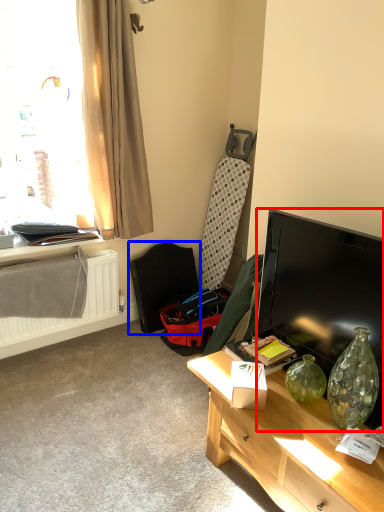
Question: Which of the following is the farthest to the observer, television (highlighted by a red box) or swivel chair (highlighted by a blue box)?

Choices:
 (A) television
 (B) swivel chair

Answer: (B)